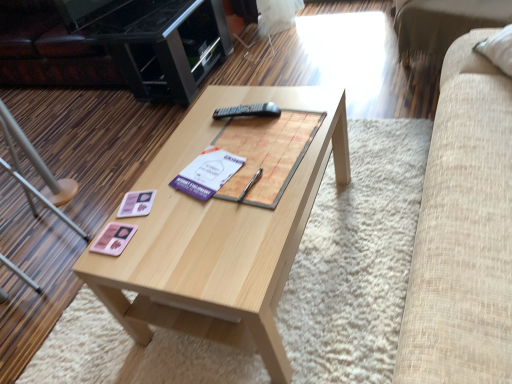
The height and width of the screenshot is (384, 512). I want to click on free space in front of pink matte card game at center, so click(x=130, y=271).